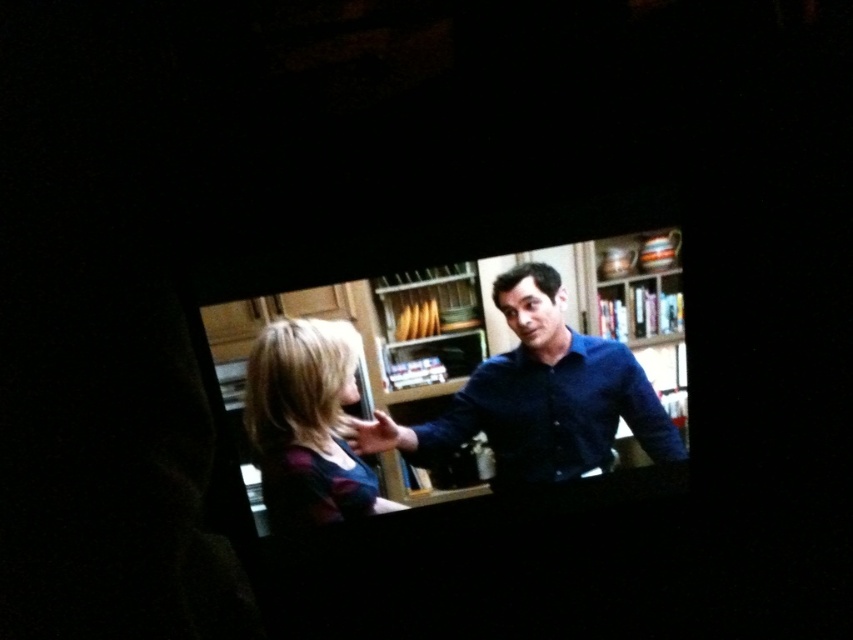
Is dark blue shirt at center positioned at the back of matte black shirt at lower left?

Yes, it is.

The image size is (853, 640). What are the coordinates of `dark blue shirt at center` in the screenshot? It's located at (538, 397).